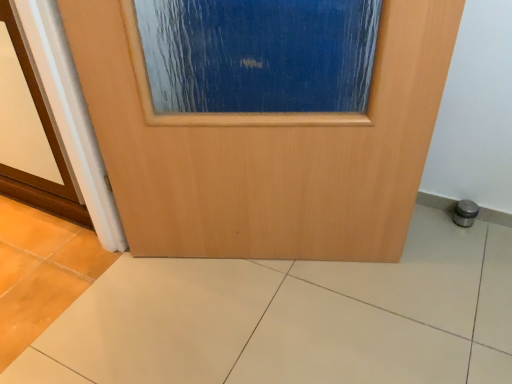
Identify the location of free spot below wooden door at center (from a real-world perspective). Image resolution: width=512 pixels, height=384 pixels. (266, 263).